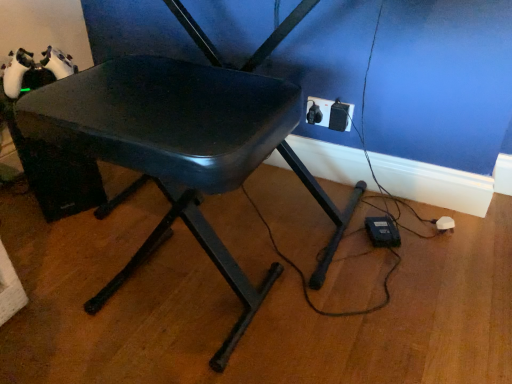
Locate an element on the screen. free region on the left part of matte black chair at center is located at coordinates (59, 283).